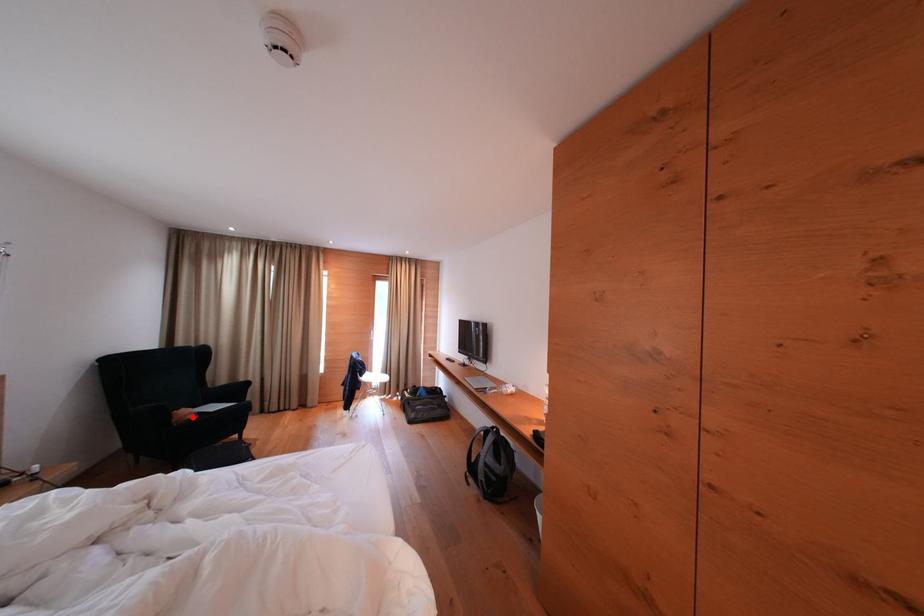
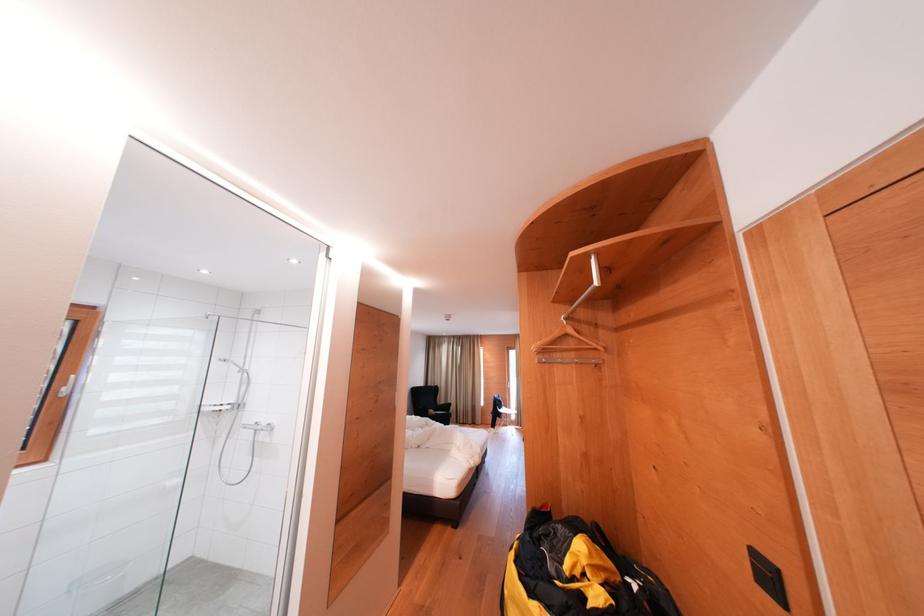
Find the pixel in the second image that matches the highlighted location in the first image.

(439, 416)